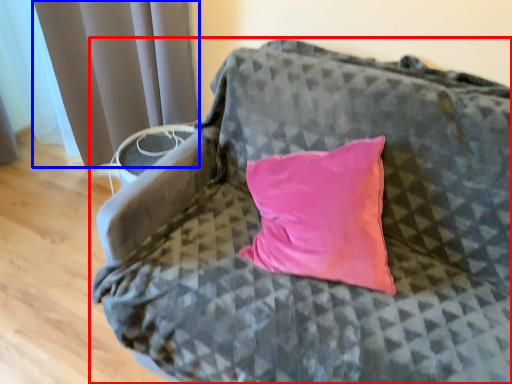
Question: Among these objects, which one is nearest to the camera, furniture (highlighted by a red box) or curtain (highlighted by a blue box)?

Choices:
 (A) furniture
 (B) curtain

Answer: (A)